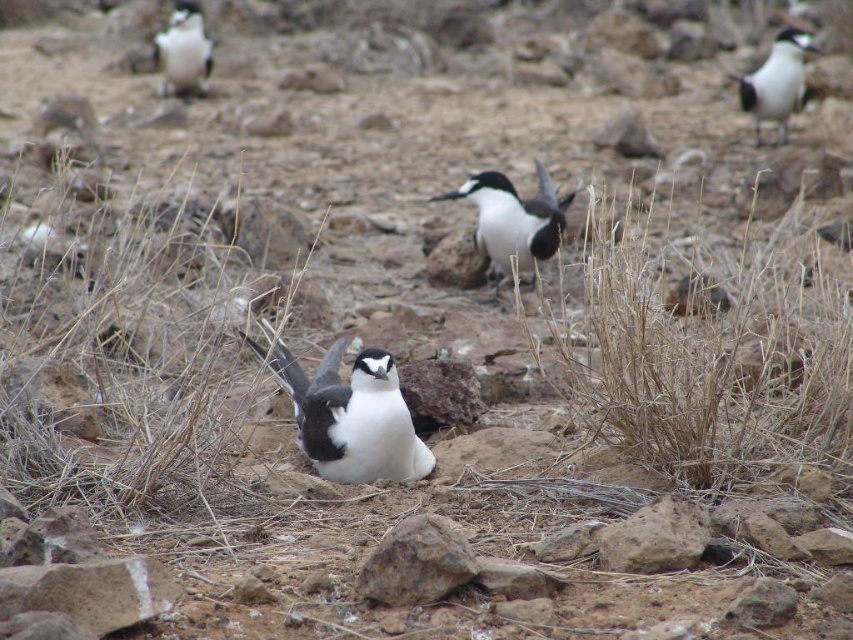
The width and height of the screenshot is (853, 640). What do you see at coordinates (416, 563) in the screenshot?
I see `brown rough rock at center` at bounding box center [416, 563].

Can you confirm if brown rough rock at center is shorter than black glossy bird at center?

Indeed, brown rough rock at center has a lesser height compared to black glossy bird at center.

Who is more forward, [379,572] or [462,182]?

Point [379,572]

At what (x,y) coordinates should I click in order to perform the action: click on brown rough rock at center. Please return your answer as a coordinate pair (x, y). Looking at the image, I should click on (416, 563).

Is white glossy bird at center smaller than black glossy bird at center?

Indeed, white glossy bird at center has a smaller size compared to black glossy bird at center.

Measure the distance between white glossy bird at center and black glossy bird at center.

white glossy bird at center is 6.80 feet from black glossy bird at center.

The width and height of the screenshot is (853, 640). What are the coordinates of `white glossy bird at center` in the screenshot? It's located at (352, 417).

Locate an element on the screen. The image size is (853, 640). white glossy bird at center is located at coordinates (352, 417).

Is white glossy penguin at upper right taller than white glossy penguin at upper left?

Yes, white glossy penguin at upper right is taller than white glossy penguin at upper left.

Which of these two, white glossy penguin at upper right or white glossy penguin at upper left, stands shorter?

Standing shorter between the two is white glossy penguin at upper left.

Who is more distant from viewer, (x=764, y=84) or (x=161, y=77)?

Positioned behind is point (x=161, y=77).

Where is `white glossy penguin at upper right`? This screenshot has height=640, width=853. white glossy penguin at upper right is located at coordinates (776, 81).